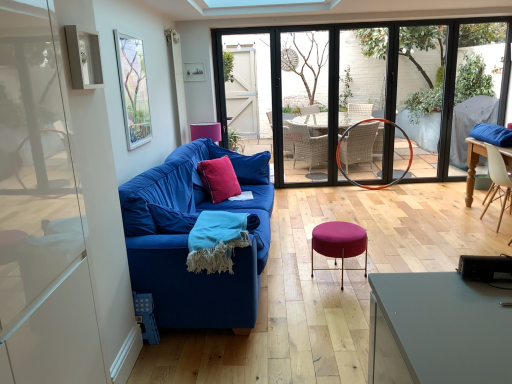
Question: From a real-world perspective, is blue fabric couch at left located higher than white wood chair at right?

Choices:
 (A) yes
 (B) no

Answer: (A)

Question: From the image's perspective, is blue fabric couch at left below white wood chair at right?

Choices:
 (A) no
 (B) yes

Answer: (B)

Question: Is blue fabric couch at left positioned in front of white wood chair at right?

Choices:
 (A) yes
 (B) no

Answer: (A)

Question: Does blue fabric couch at left appear on the left side of white wood chair at right?

Choices:
 (A) no
 (B) yes

Answer: (B)

Question: Is the position of blue fabric couch at left more distant than that of white wood chair at right?

Choices:
 (A) yes
 (B) no

Answer: (B)

Question: From a real-world perspective, is turquoise woven blanket at center positioned above or below white wood chair at right?

Choices:
 (A) below
 (B) above

Answer: (B)

Question: Is turquoise woven blanket at center inside or outside of white wood chair at right?

Choices:
 (A) inside
 (B) outside

Answer: (B)

Question: Is turquoise woven blanket at center in front of or behind white wood chair at right in the image?

Choices:
 (A) front
 (B) behind

Answer: (A)

Question: From the image's perspective, is turquoise woven blanket at center located above or below white wood chair at right?

Choices:
 (A) above
 (B) below

Answer: (B)

Question: In terms of size, does blue fabric couch at center appear bigger or smaller than purple fabric stool at center?

Choices:
 (A) big
 (B) small

Answer: (A)

Question: Is point (215, 82) closer or farther from the camera than point (324, 236)?

Choices:
 (A) farther
 (B) closer

Answer: (A)

Question: Relative to purple fabric stool at center, is blue fabric couch at center in front or behind?

Choices:
 (A) front
 (B) behind

Answer: (B)

Question: Would you say blue fabric couch at center is to the left or to the right of purple fabric stool at center in the picture?

Choices:
 (A) left
 (B) right

Answer: (A)

Question: Considering the relative positions of black plastic speaker at lower right and white wood chair at right in the image provided, is black plastic speaker at lower right to the left or to the right of white wood chair at right?

Choices:
 (A) left
 (B) right

Answer: (A)

Question: In terms of size, does black plastic speaker at lower right appear bigger or smaller than white wood chair at right?

Choices:
 (A) small
 (B) big

Answer: (A)